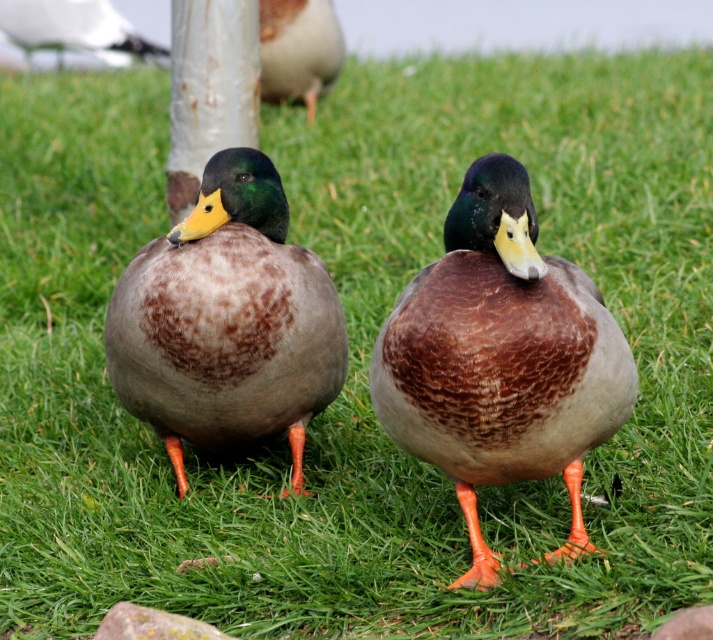
You are a birdwatcher trying to identify the ducks in the image. You notice the brown feathered duck at center and the white glossy seagull at upper left. Which of these birds is positioned to the right of the other?

The brown feathered duck at center is to the right of the white glossy seagull at upper left.

You are a birdwatcher observing the scene. You notice the brown feathered duck at center and the white glossy seagull at upper left. Which bird is taller?

The brown feathered duck at center is taller than the white glossy seagull at upper left.

You are observing two ducks in a park. You see the brown speckled duck at center and the brown feathered duck at center. Which duck is positioned to the right?

The brown speckled duck at center is positioned to the right of the brown feathered duck at center.